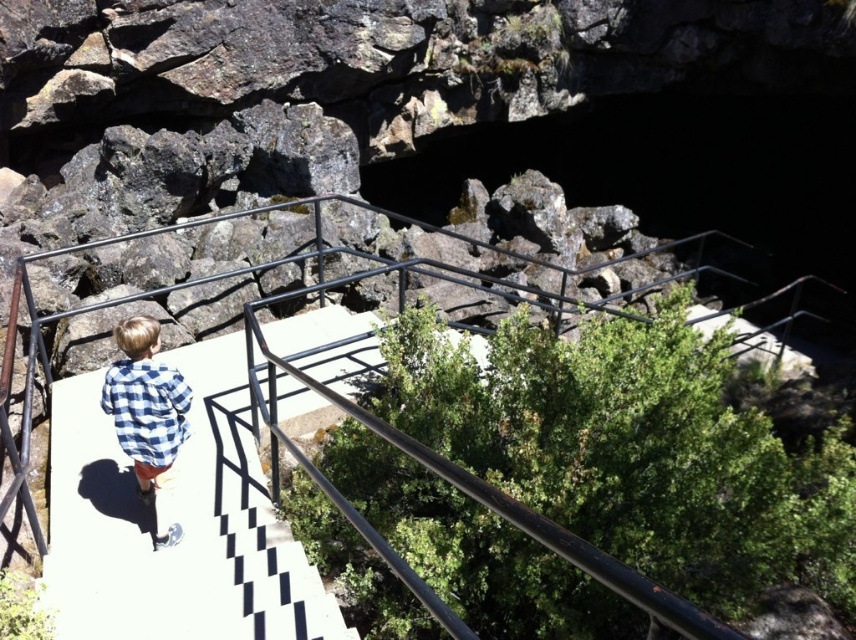
Question: Is white checkered pavement at center wider than black metal railing at center?

Choices:
 (A) no
 (B) yes

Answer: (B)

Question: Considering the real-world distances, which object is closest to the blue checkered shirt at lower left?

Choices:
 (A) white checkered pavement at center
 (B) black metal railing at center

Answer: (A)

Question: Which of the following is the closest to the observer?

Choices:
 (A) (122, 394)
 (B) (328, 198)

Answer: (A)

Question: Does white checkered pavement at center appear on the right side of blue checkered shirt at lower left?

Choices:
 (A) no
 (B) yes

Answer: (B)

Question: Does black metal railing at center appear under blue checkered shirt at lower left?

Choices:
 (A) yes
 (B) no

Answer: (B)

Question: Among these points, which one is nearest to the camera?

Choices:
 (A) (388, 262)
 (B) (173, 401)

Answer: (B)